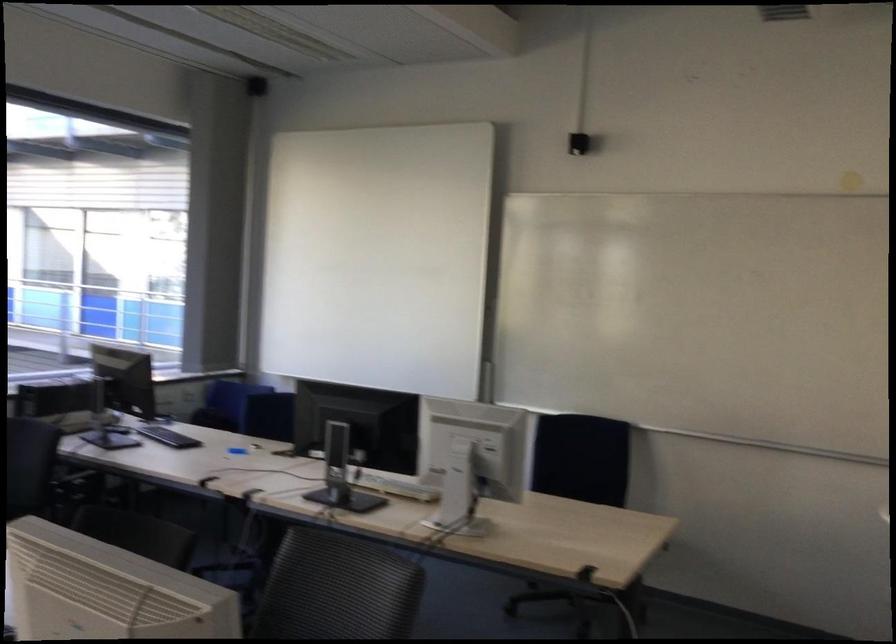
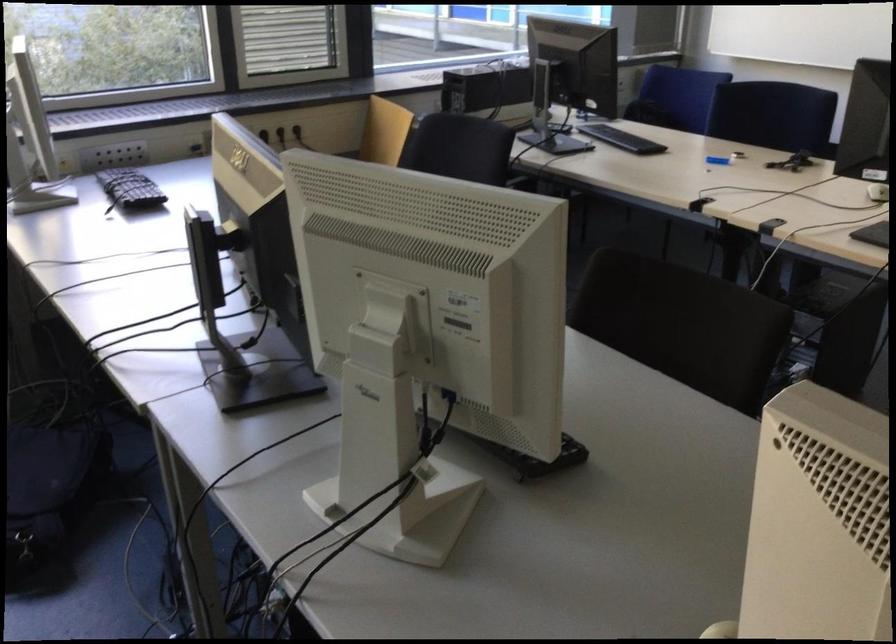
The images are taken continuously from a first-person perspective. In which direction is your viewpoint rotating?

The rotation direction of the camera is left-down.